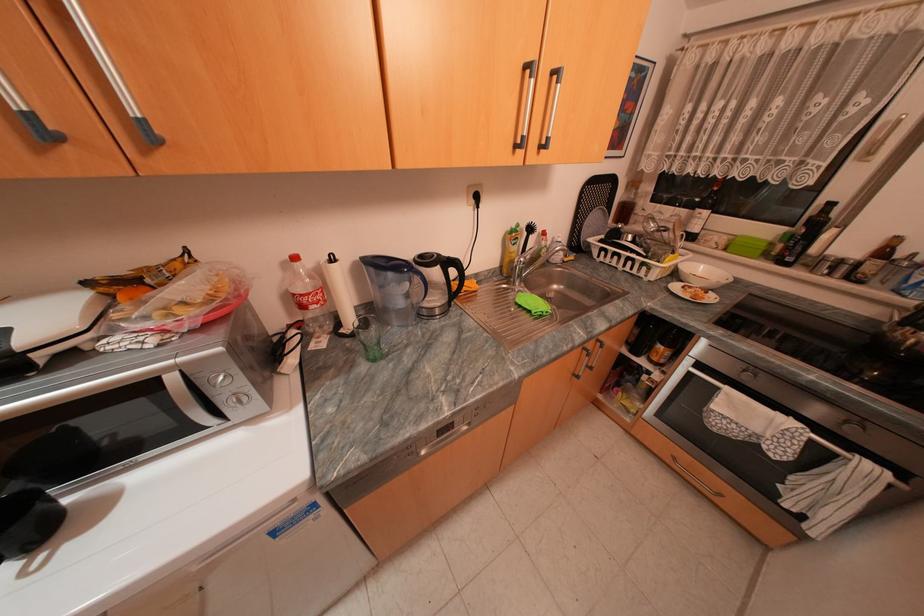
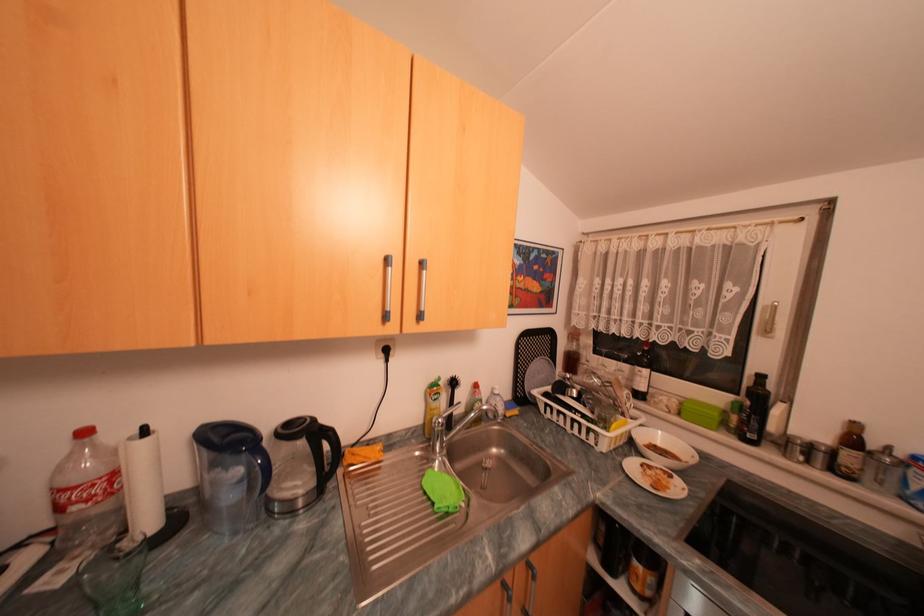
Find the pixel in the second image that matches (x=796, y=248) in the first image.

(752, 422)